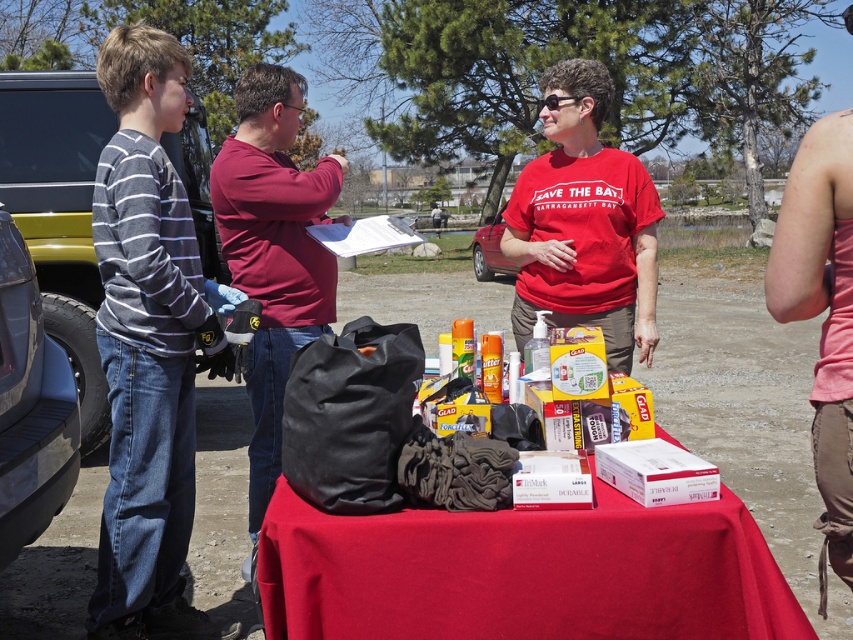
You are standing in the park and looking at the red table. There are two points marked on the table. Which point is closer to you, point (169, 630) or point (837, 381)?

Point (169, 630) is closer to you because it is further to the viewer than point (837, 381).

You are organizing items on a red table and need to place a new item between the gray striped sweater at left and the maroon cotton shirt at center. Based on their positions, where should you place the new item?

The gray striped sweater at left is in front of the maroon cotton shirt at center, so placing the new item between them would require positioning it behind the gray striped sweater at left and in front of the maroon cotton shirt at center to maintain the spatial arrangement.